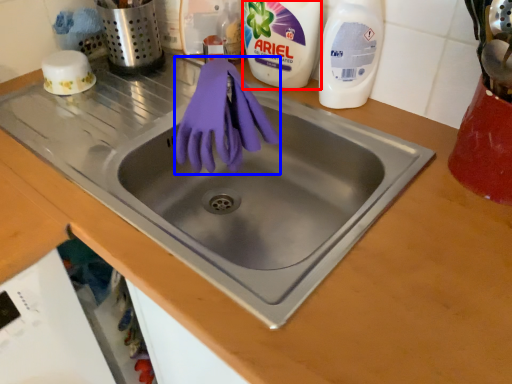
Question: Among these objects, which one is nearest to the camera, cleaning product (highlighted by a red box) or glove (highlighted by a blue box)?

Choices:
 (A) cleaning product
 (B) glove

Answer: (B)